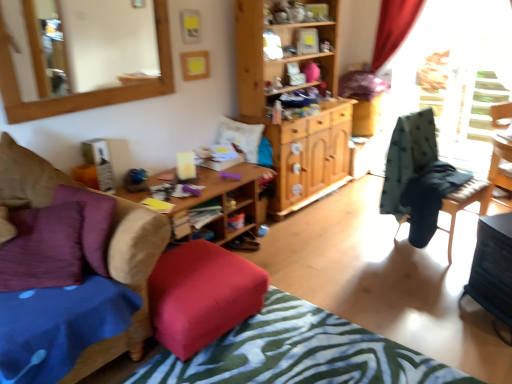
Question: Is velvet cushion at lower left, the second chair when ordered from right to left, facing away from white soft pillow at center, the second pillow in the left-to-right sequence?

Choices:
 (A) yes
 (B) no

Answer: (B)

Question: From the image's perspective, is velvet cushion at lower left, which is the 1th chair from left to right, on top of white soft pillow at center, the second pillow in the left-to-right sequence?

Choices:
 (A) yes
 (B) no

Answer: (B)

Question: Considering the relative sizes of velvet cushion at lower left, which is counted as the second chair, starting from the back, and white soft pillow at center, acting as the 2th pillow starting from the front, in the image provided, is velvet cushion at lower left, which is counted as the second chair, starting from the back, bigger than white soft pillow at center, acting as the 2th pillow starting from the front,?

Choices:
 (A) yes
 (B) no

Answer: (A)

Question: Is velvet cushion at lower left, marked as the 1th chair in a front-to-back arrangement, with white soft pillow at center, the 1th pillow from the right?

Choices:
 (A) yes
 (B) no

Answer: (B)

Question: Does velvet cushion at lower left, which is the 1th chair from left to right, have a lesser height compared to white soft pillow at center, acting as the 2th pillow starting from the front?

Choices:
 (A) no
 (B) yes

Answer: (A)

Question: Considering the positions of wooden desk at center and white soft pillow at center, placed as the 1th pillow when sorted from back to front, in the image, is wooden desk at center bigger or smaller than white soft pillow at center, placed as the 1th pillow when sorted from back to front,?

Choices:
 (A) small
 (B) big

Answer: (B)

Question: Considering the positions of wooden desk at center and white soft pillow at center, acting as the 2th pillow starting from the front, in the image, is wooden desk at center wider or thinner than white soft pillow at center, acting as the 2th pillow starting from the front,?

Choices:
 (A) wide
 (B) thin

Answer: (A)

Question: Considering the positions of point (266, 168) and point (254, 153), is point (266, 168) closer or farther from the camera than point (254, 153)?

Choices:
 (A) farther
 (B) closer

Answer: (A)

Question: From a real-world perspective, is wooden desk at center physically located above or below white soft pillow at center, acting as the 2th pillow starting from the front?

Choices:
 (A) below
 (B) above

Answer: (A)

Question: From the image's perspective, is white soft pillow at center, the second pillow in the left-to-right sequence, located above or below purple velvet pillow at left, which is the first pillow from left to right?

Choices:
 (A) below
 (B) above

Answer: (B)

Question: Considering the positions of white soft pillow at center, the second pillow in the left-to-right sequence, and purple velvet pillow at left, which is the second pillow in right-to-left order, in the image, is white soft pillow at center, the second pillow in the left-to-right sequence, taller or shorter than purple velvet pillow at left, which is the second pillow in right-to-left order,?

Choices:
 (A) tall
 (B) short

Answer: (B)

Question: Is white soft pillow at center, the 1th pillow from the right, in front of or behind purple velvet pillow at left, the 1th pillow from the front, in the image?

Choices:
 (A) behind
 (B) front

Answer: (A)

Question: Would you say white soft pillow at center, placed as the 1th pillow when sorted from back to front, is to the left or to the right of purple velvet pillow at left, the 1th pillow from the front, in the picture?

Choices:
 (A) left
 (B) right

Answer: (B)

Question: Does point (251, 130) appear closer or farther from the camera than point (449, 16)?

Choices:
 (A) farther
 (B) closer

Answer: (B)

Question: Based on their positions, is white soft pillow at center, acting as the 2th pillow starting from the front, located to the left or right of green fabric chair at right?

Choices:
 (A) left
 (B) right

Answer: (A)